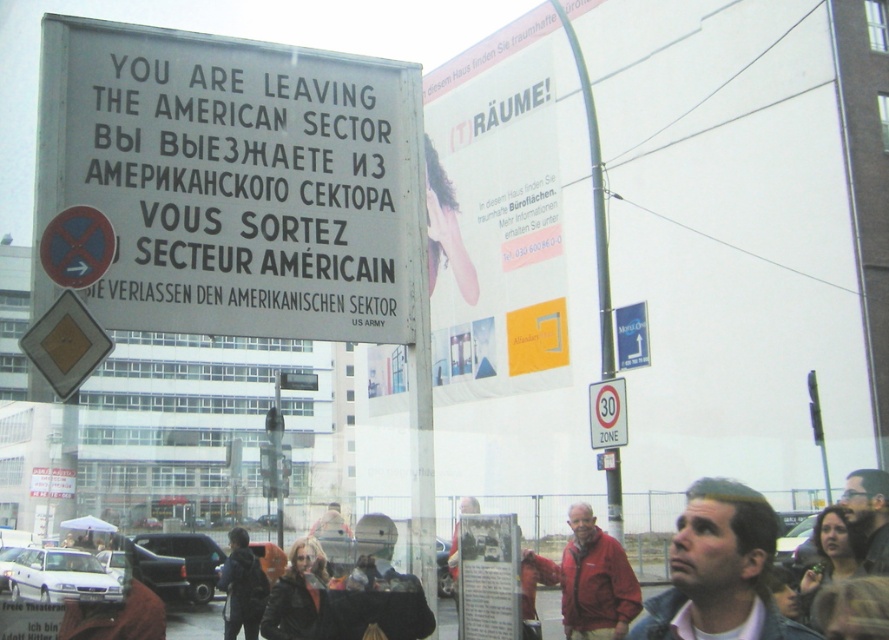
You are standing in the urban scene and want to move from the point at coordinates point (195,292) to the point at coordinates point (611,404). Which direction should you walk to reach your destination?

You should walk backward because point (195,292) is in front of point (611,404), meaning the destination is behind you.

You are a tourist in a city and you see the white plastic sign at upper left and the metallic rectangular speed limit sign at right. Which sign is taller?

The white plastic sign at upper left is taller than the metallic rectangular speed limit sign at right.